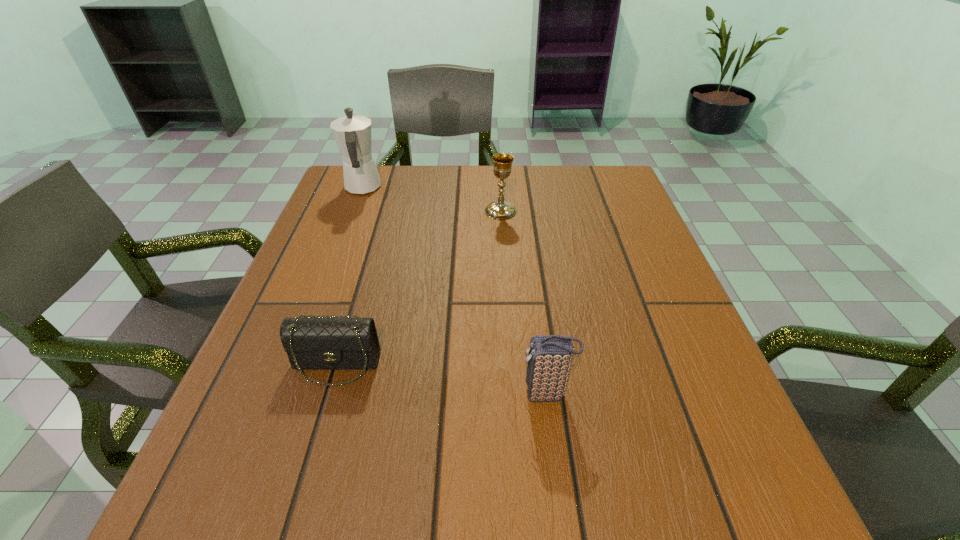
Locate an element on the screen. This screenshot has height=540, width=960. blank space located 0.160m on the front flap of the left clutch bag is located at coordinates [300, 486].

Locate an element on the screen. The height and width of the screenshot is (540, 960). coffeepot present at the far edge is located at coordinates (352, 133).

Identify the location of chalice that is at the far edge. (500, 210).

You are a GUI agent. You are given a task and a screenshot of the screen. Output one action in this format:
    pyautogui.click(x=<x>, y=<y>)
    Task: Click on the coffeepot present at the left edge
    This screenshot has height=540, width=960.
    Given the screenshot: What is the action you would take?
    pyautogui.click(x=352, y=133)

Where is `clutch bag present at the left edge`? The height and width of the screenshot is (540, 960). clutch bag present at the left edge is located at coordinates (320, 343).

The image size is (960, 540). Find the location of `object situated at the far left corner`. object situated at the far left corner is located at coordinates (352, 133).

You are a GUI agent. You are given a task and a screenshot of the screen. Output one action in this format:
    pyautogui.click(x=<x>, y=<y>)
    Task: Click on the free space at the far edge of the desktop
    The image size is (960, 540).
    Given the screenshot: What is the action you would take?
    pyautogui.click(x=413, y=185)

Find the location of a particular element. The image size is (960, 540). free space at the near edge of the desktop is located at coordinates 349,525.

Where is `vacant region at the left edge`? The height and width of the screenshot is (540, 960). vacant region at the left edge is located at coordinates (305, 318).

Image resolution: width=960 pixels, height=540 pixels. What are the coordinates of `free space at the right edge` in the screenshot? It's located at (687, 348).